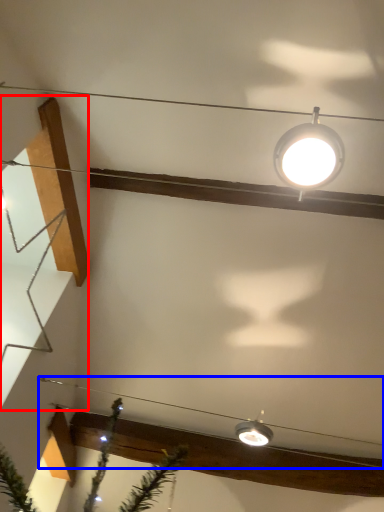
Question: Which point is further to the camera, stairwell (highlighted by a red box) or wire (highlighted by a blue box)?

Choices:
 (A) stairwell
 (B) wire

Answer: (B)